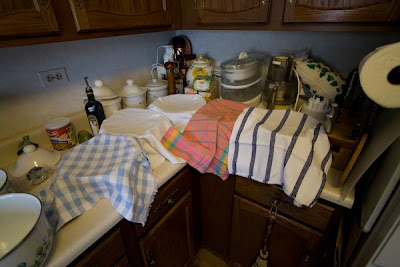
Locate an element on the screen. dish towels is located at coordinates (252, 160), (212, 147), (179, 106), (142, 126), (108, 155), (327, 73).